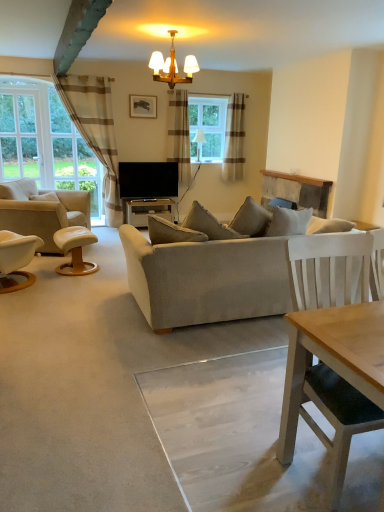
What do you see at coordinates (143, 106) in the screenshot? I see `matte black picture frame at upper center` at bounding box center [143, 106].

At what (x,y) coordinates should I click in order to perform the action: click on beige striped curtain at center, the 3th curtain viewed from the left. Please return your answer as a coordinate pair (x, y). The image size is (384, 512). Looking at the image, I should click on (234, 139).

Describe the element at coordinates (179, 134) in the screenshot. I see `plaid fabric curtain at center, marked as the 2th curtain in a right-to-left arrangement` at that location.

Measure the distance between plaid fabric curtain at center, the 2th curtain positioned from the left, and camera.

plaid fabric curtain at center, the 2th curtain positioned from the left, and camera are 7.11 meters apart.

The height and width of the screenshot is (512, 384). I want to click on light beige fabric couch at center, so click(209, 227).

The image size is (384, 512). What do you see at coordinates (209, 227) in the screenshot? I see `light beige fabric couch at center` at bounding box center [209, 227].

The image size is (384, 512). Identify the location of matte black picture frame at upper center. click(x=143, y=106).

Can you confirm if matte wooden chandelier at upper center, the 2th lamp when ordered from back to front, is positioned to the left of flat screen tv at center?

Incorrect, matte wooden chandelier at upper center, the 2th lamp when ordered from back to front, is not on the left side of flat screen tv at center.

From a real-world perspective, is matte wooden chandelier at upper center, the 2th lamp when ordered from back to front, over flat screen tv at center?

Indeed, from a real-world perspective, matte wooden chandelier at upper center, the 2th lamp when ordered from back to front, stands above flat screen tv at center.

From the image's perspective, is matte wooden chandelier at upper center, the first lamp when ordered from front to back, positioned above or below flat screen tv at center?

matte wooden chandelier at upper center, the first lamp when ordered from front to back, is situated higher than flat screen tv at center in the image.

Considering the positions of objects clear glass window at left and plaid fabric curtain at center, the 2th curtain positioned from the left, in the image provided, who is more to the left, clear glass window at left or plaid fabric curtain at center, the 2th curtain positioned from the left,?

clear glass window at left.

Measure the distance between clear glass window at left and plaid fabric curtain at center, marked as the 2th curtain in a right-to-left arrangement.

They are 2.40 meters apart.

Is clear glass window at left not near plaid fabric curtain at center, the 2th curtain positioned from the left?

Absolutely, clear glass window at left is distant from plaid fabric curtain at center, the 2th curtain positioned from the left.

Would you say clear glass window at left is inside or outside plaid fabric curtain at center, the 2th curtain positioned from the left?

clear glass window at left is located beyond the bounds of plaid fabric curtain at center, the 2th curtain positioned from the left.

Is clear glass window at center not close to white leather stool at left?

Yes.

Between clear glass window at center and white leather stool at left, which one has larger size?

white leather stool at left is bigger.

Is clear glass window at center positioned with its back to white leather stool at left?

No, white leather stool at left is not at the back of clear glass window at center.

Locate an element on the screen. The height and width of the screenshot is (512, 384). stool in front of the clear glass window at center is located at coordinates (75, 250).

Who is taller, white leather stool at left or clear glass window at left?

Standing taller between the two is clear glass window at left.

From a real-world perspective, which object rests below the other?

white leather stool at left is physically lower.

Locate an element on the screen. window screen behind the white leather stool at left is located at coordinates (20, 135).

Relative to clear glass window at left, is white leather stool at left in front or behind?

Visually, white leather stool at left is located in front of clear glass window at left.

Considering the sizes of objects white leather stool at left and light beige fabric couch at center in the image provided, who is thinner, white leather stool at left or light beige fabric couch at center?

white leather stool at left.

Could you tell me if white leather stool at left is facing light beige fabric couch at center?

No, white leather stool at left is not oriented towards light beige fabric couch at center.

Is white leather stool at left smaller than light beige fabric couch at center?

Yes.

Are white leather stool at left and light beige fabric couch at center located far from each other?

Absolutely, white leather stool at left is distant from light beige fabric couch at center.

Based on their positions, is clear glass window at center located to the left or right of black glossy desk at center?

From the image, it's evident that clear glass window at center is to the right of black glossy desk at center.

How different are the orientations of clear glass window at center and black glossy desk at center in degrees?

The angular difference between clear glass window at center and black glossy desk at center is 1.2 degrees.

Is clear glass window at center turned away from black glossy desk at center?

No, clear glass window at center's orientation is not away from black glossy desk at center.

Is clear glass window at center smaller than black glossy desk at center?

Yes.

Does point (187, 152) lie in front of point (147, 297)?

No, (187, 152) is behind (147, 297).

Does plaid fabric curtain at center, the 2th curtain positioned from the left, have a lesser height compared to light beige fabric couch at center?

No, plaid fabric curtain at center, the 2th curtain positioned from the left, is not shorter than light beige fabric couch at center.

This screenshot has width=384, height=512. What are the coordinates of `studio couch that is below the plaid fabric curtain at center, marked as the 2th curtain in a right-to-left arrangement (from the image's perspective)` in the screenshot? It's located at (209, 227).

Is plaid fabric curtain at center, marked as the 2th curtain in a right-to-left arrangement, at the left side of light beige fabric couch at center?

Indeed, plaid fabric curtain at center, marked as the 2th curtain in a right-to-left arrangement, is positioned on the left side of light beige fabric couch at center.

The height and width of the screenshot is (512, 384). Identify the location of the 2nd lamp above the flat screen tv at center (from a real-world perspective). (172, 66).

What are the coordinates of `the 2nd curtain to the right of the clear glass window at left, counting from the anchor's position` in the screenshot? It's located at (179, 134).

When comparing their distances from white leather ottoman at left, does matte black picture frame at upper center or beige striped curtain at center, the 3th curtain viewed from the left, seem closer?

matte black picture frame at upper center lies closer to white leather ottoman at left than the other object.

Which object lies further to the anchor point matte wooden chandelier at upper center, the 2th lamp when ordered from back to front, beige striped curtain at center, the 3th curtain viewed from the left, or clear glass window at center?

beige striped curtain at center, the 3th curtain viewed from the left, is positioned further to the anchor matte wooden chandelier at upper center, the 2th lamp when ordered from back to front.

Estimate the real-world distances between objects in this image. Which object is closer to clear glass window at center, matte wooden chandelier at upper center, the first lamp when ordered from front to back, or beige striped curtain at center, which is the 1th curtain in right-to-left order?

Among the two, beige striped curtain at center, which is the 1th curtain in right-to-left order, is located nearer to clear glass window at center.

Which object lies nearer to the anchor point brown striped curtain at left, which is the third curtain in right-to-left order, black glossy desk at center or matte wooden chandelier at upper center, the first lamp when ordered from front to back?

black glossy desk at center is positioned closer to the anchor brown striped curtain at left, which is the third curtain in right-to-left order.

When comparing their distances from matte wooden chandelier at upper center, the first lamp when ordered from front to back, does flat screen tv at center or beige striped curtain at center, the 3th curtain viewed from the left, seem further?

beige striped curtain at center, the 3th curtain viewed from the left.

Based on their spatial positions, is white leather stool at left or brown striped curtain at left, which is the 1th curtain in left-to-right order, closer to plaid fabric curtain at center, marked as the 2th curtain in a right-to-left arrangement?

Based on the image, brown striped curtain at left, which is the 1th curtain in left-to-right order, appears to be nearer to plaid fabric curtain at center, marked as the 2th curtain in a right-to-left arrangement.

Estimate the real-world distances between objects in this image. Which object is further from white leather ottoman at left, light beige fabric couch at center or brown striped curtain at left, which is the 1th curtain in left-to-right order?

light beige fabric couch at center is positioned further to the anchor white leather ottoman at left.

Based on the photo, which object lies further to the anchor point matte wooden chandelier at upper center, the first lamp when ordered from front to back, matte black picture frame at upper center or brown striped curtain at left, which is the third curtain in right-to-left order?

brown striped curtain at left, which is the third curtain in right-to-left order.

Find the location of a particular element. Image resolution: width=384 pixels, height=512 pixels. studio couch between matte wooden chandelier at upper center, the 2th lamp when ordered from back to front, and white leather stool at left vertically is located at coordinates 209,227.

At what (x,y) coordinates should I click in order to perform the action: click on window screen positioned between matte wooden chandelier at upper center, the 2th lamp when ordered from back to front, and white fabric lampshade at upper center, the 2th lamp viewed from the front, from near to far. Please return your answer as a coordinate pair (x, y). Image resolution: width=384 pixels, height=512 pixels. Looking at the image, I should click on 20,135.

Identify the location of stool located between clear glass window at left and white fabric lampshade at upper center, which is the 1th lamp in back-to-front order, in the left-right direction. (75, 250).

Image resolution: width=384 pixels, height=512 pixels. I want to click on desk located between clear glass window at left and clear glass window at center in the left-right direction, so click(x=146, y=210).